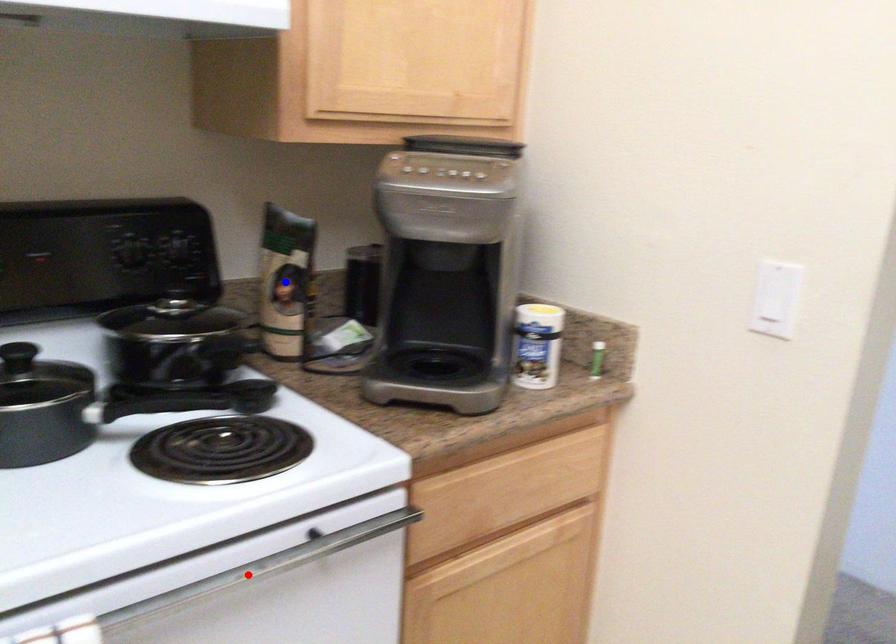
Question: Two points are marked on the image. Which point is closer to the camera?

Choices:
 (A) Blue point is closer.
 (B) Red point is closer.

Answer: (B)